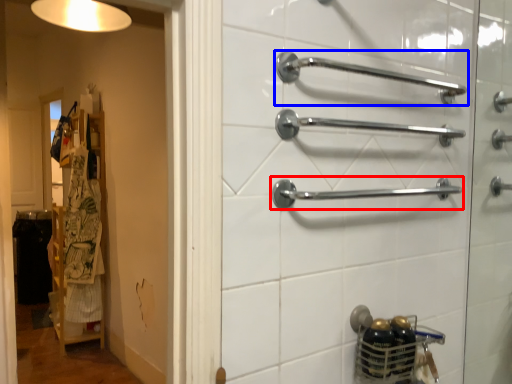
Question: Which point is closer to the camera, towel rack (highlighted by a red box) or towel rack (highlighted by a blue box)?

Choices:
 (A) towel rack
 (B) towel rack

Answer: (B)